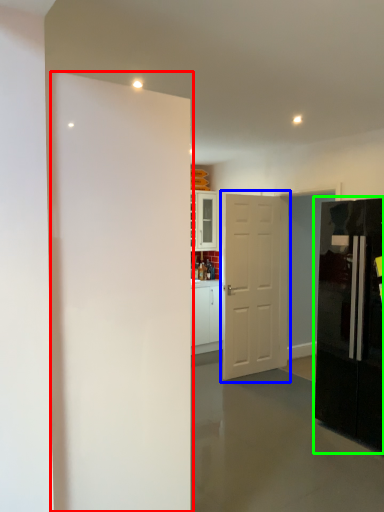
Question: Which is nearer to the door (highlighted by a red box)? door (highlighted by a blue box) or refrigerator (highlighted by a green box).

Choices:
 (A) door
 (B) refrigerator

Answer: (B)